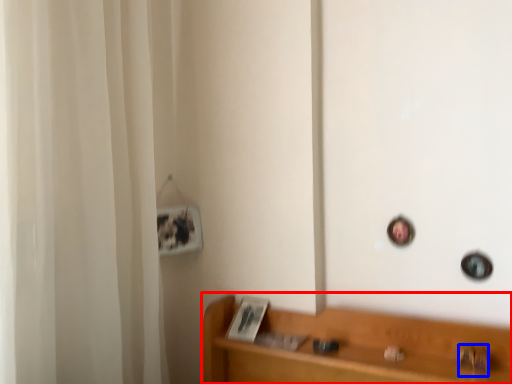
Question: Which object is closer to the camera taking this photo, furniture (highlighted by a red box) or door handle (highlighted by a blue box)?

Choices:
 (A) furniture
 (B) door handle

Answer: (A)